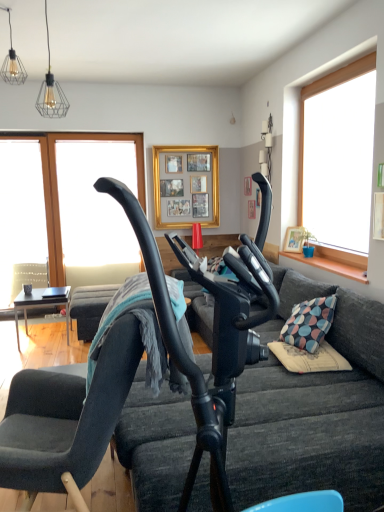
Question: Is velvet dark gray chair at center smaller than transparent glass window at upper left, which ranks as the second window screen in left-to-right order?

Choices:
 (A) yes
 (B) no

Answer: (B)

Question: Is velvet dark gray chair at center outside of transparent glass window at upper left, which ranks as the second window screen in left-to-right order?

Choices:
 (A) yes
 (B) no

Answer: (A)

Question: From the image's perspective, is velvet dark gray chair at center on top of transparent glass window at upper left, positioned as the 1th window screen in right-to-left order?

Choices:
 (A) no
 (B) yes

Answer: (A)

Question: From the image's perspective, is velvet dark gray chair at center below transparent glass window at upper left, positioned as the 1th window screen in right-to-left order?

Choices:
 (A) no
 (B) yes

Answer: (B)

Question: Considering the relative positions of velvet dark gray chair at center and transparent glass window at upper left, positioned as the 1th window screen in right-to-left order, in the image provided, is velvet dark gray chair at center to the right of transparent glass window at upper left, positioned as the 1th window screen in right-to-left order, from the viewer's perspective?

Choices:
 (A) yes
 (B) no

Answer: (A)

Question: Would you say black matte table at left is inside or outside dark gray fabric couch at center?

Choices:
 (A) outside
 (B) inside

Answer: (A)

Question: In the image, is black matte table at left on the left side or the right side of dark gray fabric couch at center?

Choices:
 (A) right
 (B) left

Answer: (B)

Question: In the image, is black matte table at left positioned in front of or behind dark gray fabric couch at center?

Choices:
 (A) behind
 (B) front

Answer: (A)

Question: Considering the positions of black matte table at left and dark gray fabric couch at center in the image, is black matte table at left wider or thinner than dark gray fabric couch at center?

Choices:
 (A) wide
 (B) thin

Answer: (B)

Question: From the image's perspective, is transparent glass window at left, which appears as the 1th window screen when viewed from the left, located above or below gold/gilded picture frame at upper center?

Choices:
 (A) above
 (B) below

Answer: (B)

Question: Looking at their shapes, would you say transparent glass window at left, marked as the second window screen in a right-to-left arrangement, is wider or thinner than gold/gilded picture frame at upper center?

Choices:
 (A) wide
 (B) thin

Answer: (B)

Question: From a real-world perspective, is transparent glass window at left, which appears as the 1th window screen when viewed from the left, physically located above or below gold/gilded picture frame at upper center?

Choices:
 (A) below
 (B) above

Answer: (A)

Question: Is transparent glass window at left, marked as the second window screen in a right-to-left arrangement, in front of or behind gold/gilded picture frame at upper center in the image?

Choices:
 (A) behind
 (B) front

Answer: (B)

Question: Considering the positions of black matte table at left and transparent glass window at upper left, positioned as the 1th window screen in right-to-left order, in the image, is black matte table at left taller or shorter than transparent glass window at upper left, positioned as the 1th window screen in right-to-left order,?

Choices:
 (A) tall
 (B) short

Answer: (B)

Question: Do you think black matte table at left is within transparent glass window at upper left, positioned as the 1th window screen in right-to-left order, or outside of it?

Choices:
 (A) inside
 (B) outside

Answer: (B)